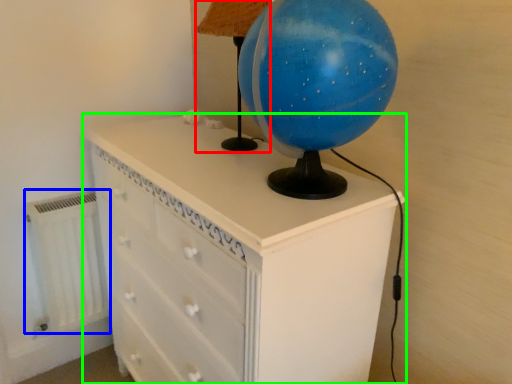
Question: Based on their relative distances, which object is farther from table lamp (highlighted by a red box)? Choose from radiator (highlighted by a blue box) and chest of drawers (highlighted by a green box).

Choices:
 (A) radiator
 (B) chest of drawers

Answer: (A)